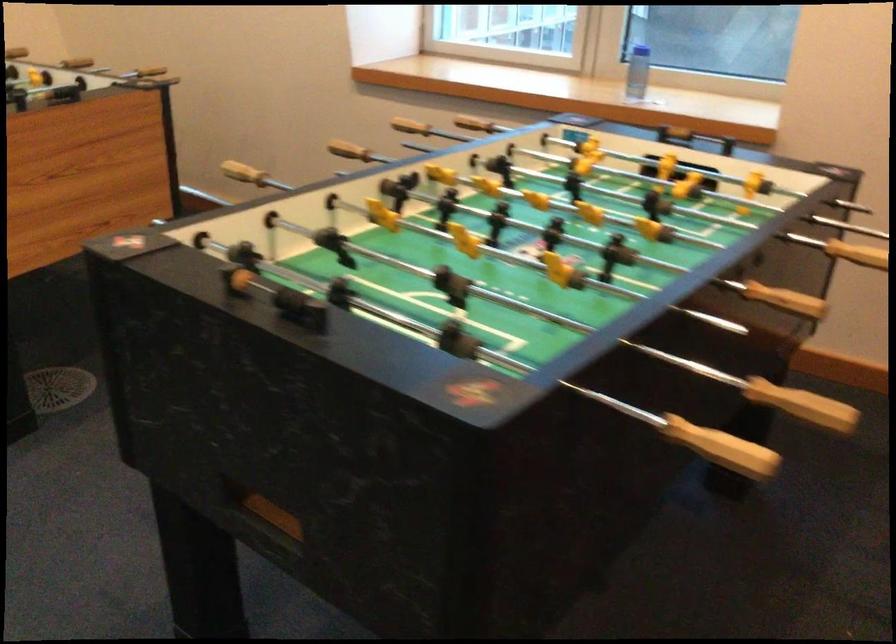
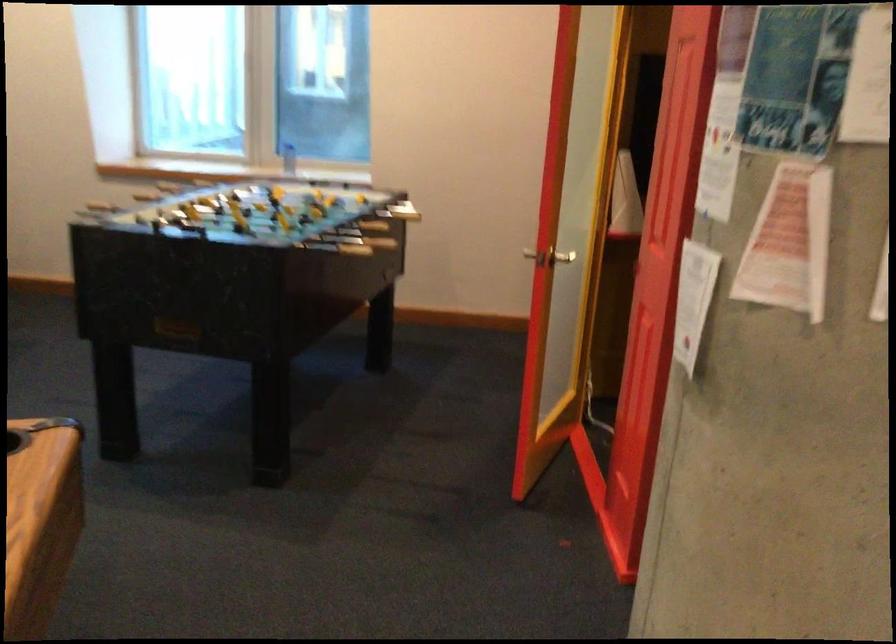
Where in the second image is the point corresponding to point (803, 404) from the first image?

(381, 229)